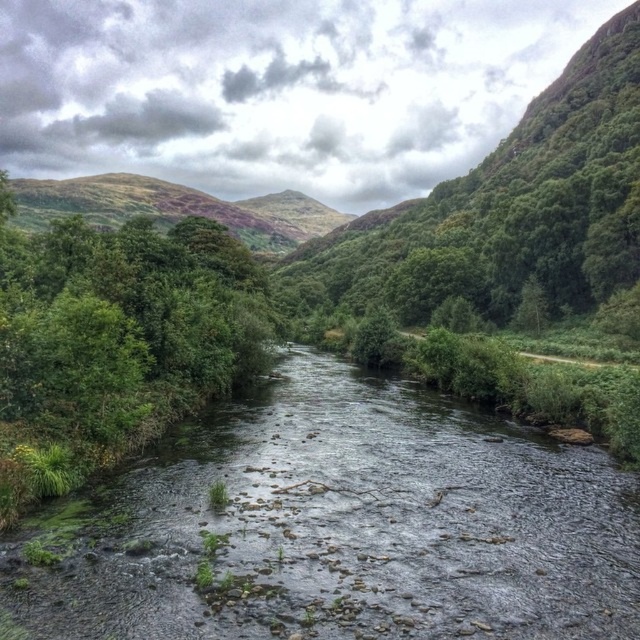
Is clear water at center below green mossy hillside at center?

Indeed, clear water at center is positioned under green mossy hillside at center.

Between clear water at center and green mossy hillside at center, which one appears on the left side from the viewer's perspective?

green mossy hillside at center

Does point (426, 490) lie behind point (314, 227)?

No, it is not.

Find the location of a particular element. clear water at center is located at coordinates (340, 525).